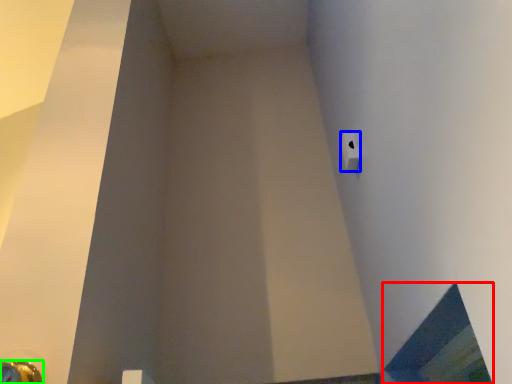
Question: Considering the real-world distances, which object is farthest from window (highlighted by a red box)? toilet paper (highlighted by a blue box) or door handle (highlighted by a green box)?

Choices:
 (A) toilet paper
 (B) door handle

Answer: (B)